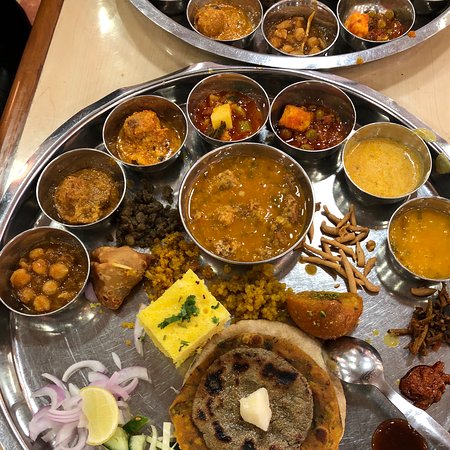
Where is `spoon handle`? This screenshot has height=450, width=450. spoon handle is located at coordinates (431, 430).